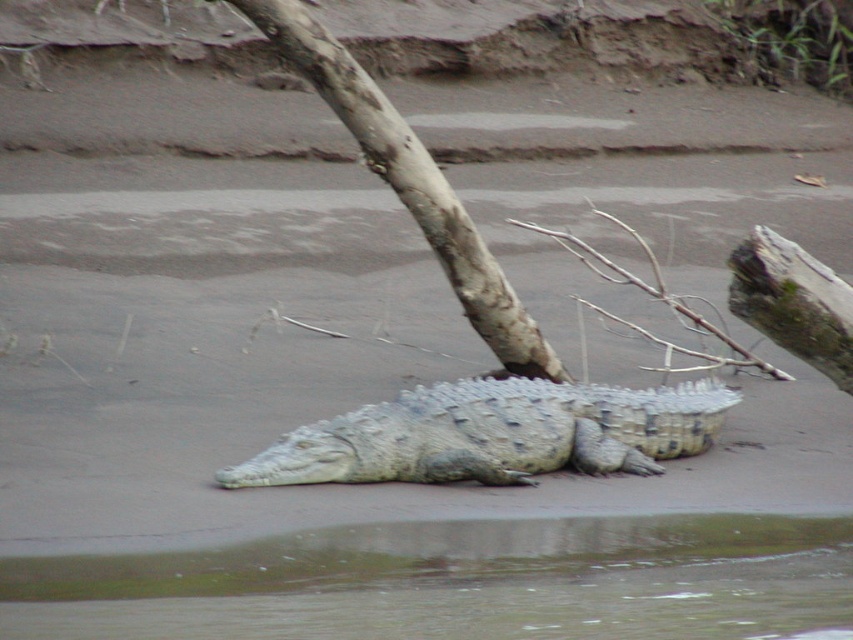
Question: Can you confirm if greenish water at lower center is positioned to the right of sandy textured crocodile at center?

Choices:
 (A) yes
 (B) no

Answer: (B)

Question: In this image, where is sandy textured crocodile at center located relative to smooth gray bark at center?

Choices:
 (A) left
 (B) right

Answer: (B)

Question: Among these points, which one is farthest from the camera?

Choices:
 (A) (592, 428)
 (B) (689, 353)
 (C) (410, 205)

Answer: (B)

Question: Which object is closer to the camera taking this photo?

Choices:
 (A) brown rough branch at center right
 (B) greenish water at lower center

Answer: (B)

Question: Is greenish water at lower center to the left of sandy textured crocodile at center from the viewer's perspective?

Choices:
 (A) yes
 (B) no

Answer: (A)

Question: Estimate the real-world distances between objects in this image. Which object is farther from the sandy textured crocodile at center?

Choices:
 (A) smooth gray bark at center
 (B) greenish water at lower center
 (C) brown rough branch at center right

Answer: (C)